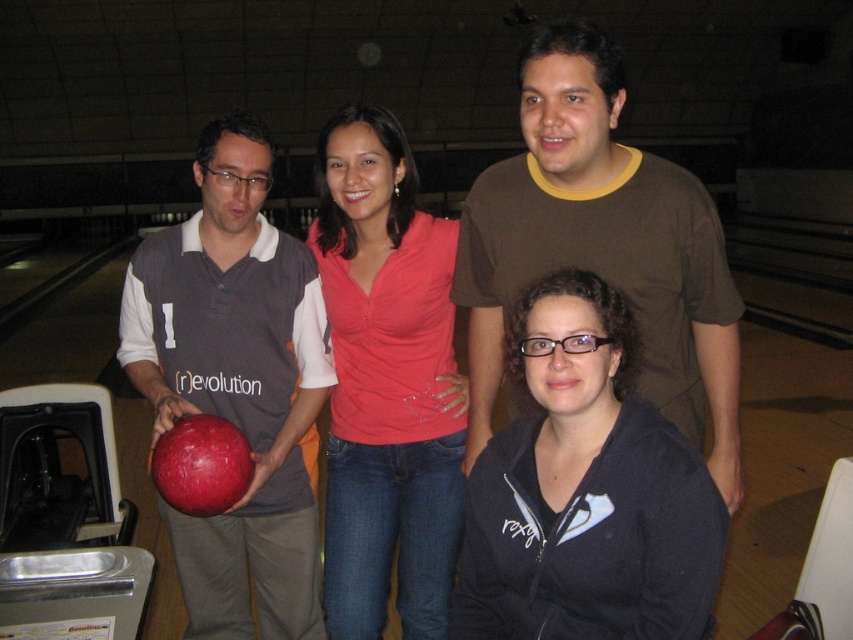
You are standing at the origin point of the coordinate system in the image. The coordinates of the brown cotton t shirt at upper center are given as point [602,244]. If you move 0.1 units to the right along the x axis, will you be closer to or farther from the brown cotton t shirt at upper center?

Moving 0.1 units to the right along the x axis from the origin point would take you closer to the brown cotton t shirt at upper center since its x coordinate is 0.383, which is greater than 0.0. Therefore, moving in the positive x direction decreases the distance between you and the object.

You are a photographer setting up for a group photo at a bowling alley. You have a matte gray shirt at center and a rubberized red bowling ball at center in your frame. Which object should you focus on first if you want to capture the larger object in your shot?

The matte gray shirt at center is bigger than the rubberized red bowling ball at center, so you should focus on the matte gray shirt at center first to capture the larger object.